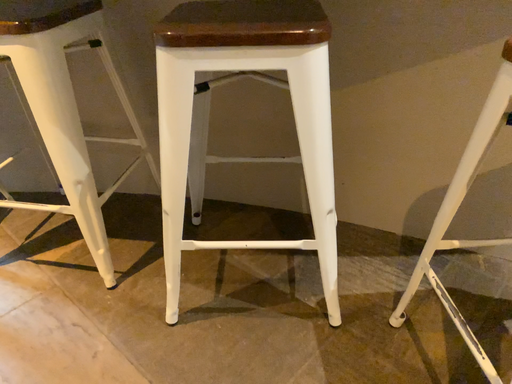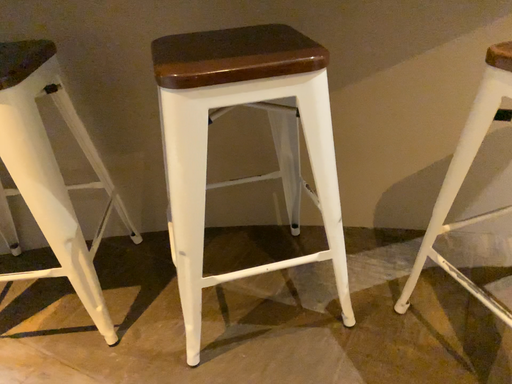
Question: Which way did the camera rotate in the video?

Choices:
 (A) rotated left
 (B) rotated right

Answer: (B)